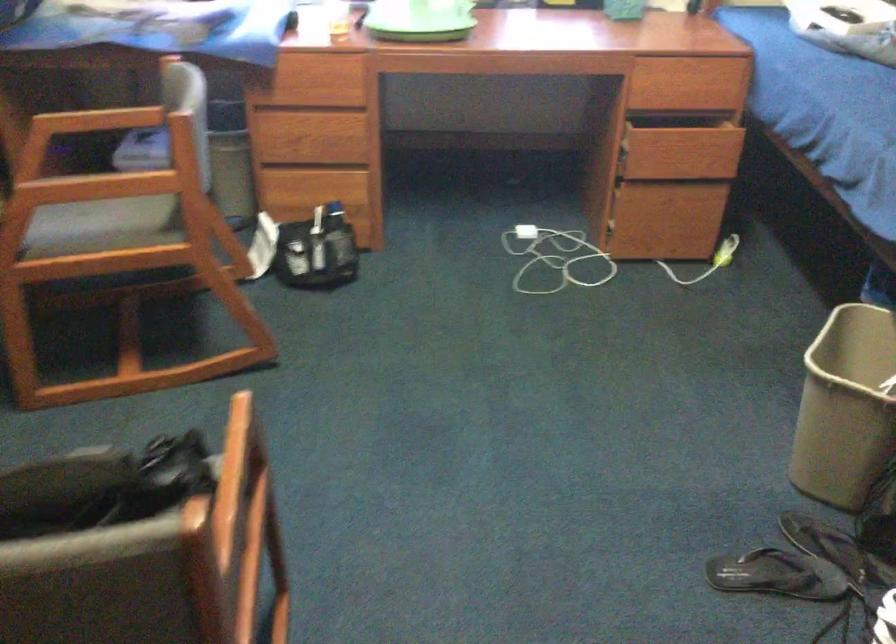
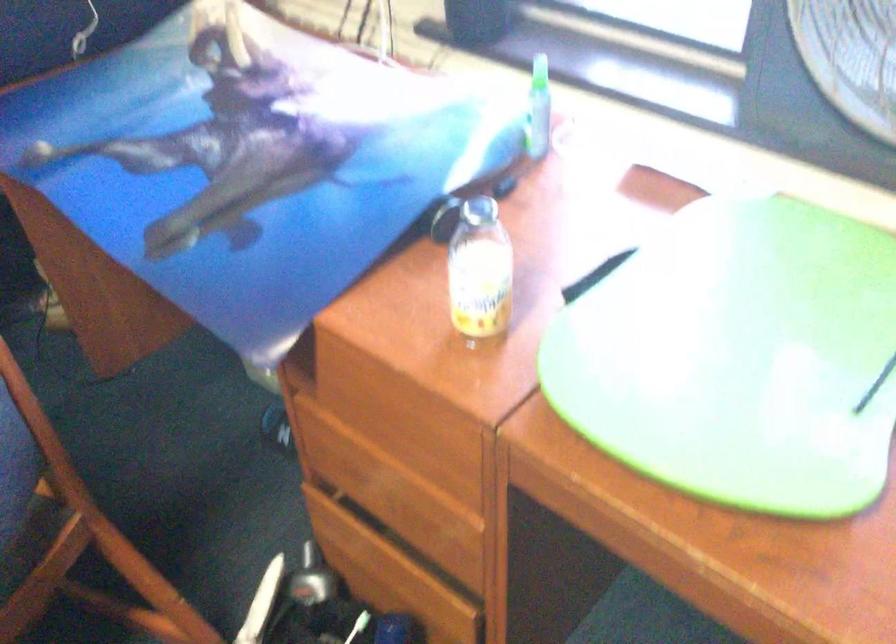
In the second image, find the point that corresponds to pixel 323 120 in the first image.

(408, 485)